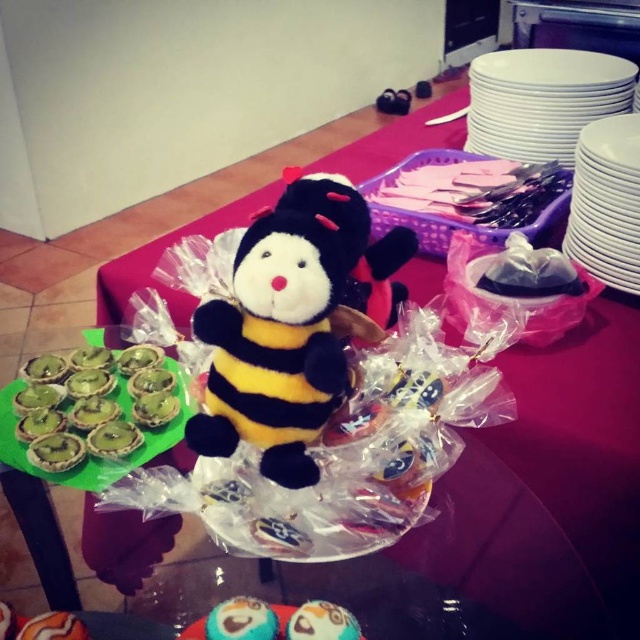
In the scene shown: Can you confirm if blue matte plush toy at center is wider than smooth chocolate cupcake at center?

Yes.

Which is behind, point (209, 636) or point (32, 621)?

The point (32, 621) is more distant.

This screenshot has height=640, width=640. Identify the location of blue matte plush toy at center. (241, 620).

Does point (320, 604) come farther from viewer compared to point (40, 625)?

Yes, point (320, 604) is behind point (40, 625).

Is point (323, 602) more distant than point (60, 612)?

Yes, it is behind point (60, 612).

Image resolution: width=640 pixels, height=640 pixels. I want to click on smooth glossy cake at center, so click(321, 621).

Between soft plush bee at center and smooth glossy cake at center, which one appears on the left side from the viewer's perspective?

soft plush bee at center

Who is more distant from viewer, [349,312] or [305,620]?

The point [349,312] is more distant.

Is point (275, 364) positioned in front of point (298, 616)?

No, (275, 364) is behind (298, 616).

You are a GUI agent. You are given a task and a screenshot of the screen. Output one action in this format:
    pyautogui.click(x=<x>, y=<y>)
    Task: Click on the soft plush bee at center
    Image resolution: width=640 pixels, height=640 pixels.
    Given the screenshot: What is the action you would take?
    pyautogui.click(x=285, y=328)